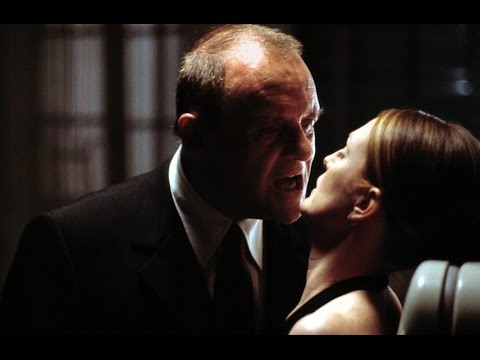
The width and height of the screenshot is (480, 360). Find the location of `window trim`. window trim is located at coordinates (114, 145).